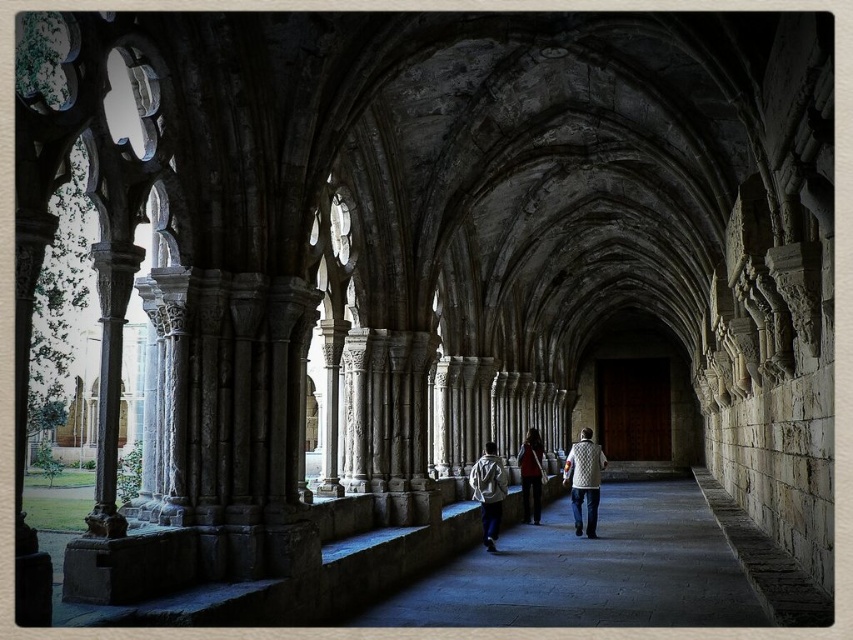
How far apart are white fabric jacket at center and matte red sweater at center?

white fabric jacket at center is 15.92 meters away from matte red sweater at center.

Is point (491, 468) closer to camera compared to point (535, 444)?

That is True.

Is point (485, 445) in front of point (523, 506)?

Yes, it is.

The height and width of the screenshot is (640, 853). In order to click on white fabric jacket at center in this screenshot , I will do `click(488, 492)`.

Which of these two, dark stone path at center or white knitted vest at center, stands taller?

With more height is white knitted vest at center.

Is dark stone path at center to the left of white knitted vest at center from the viewer's perspective?

Yes, dark stone path at center is to the left of white knitted vest at center.

The height and width of the screenshot is (640, 853). Describe the element at coordinates (590, 570) in the screenshot. I see `dark stone path at center` at that location.

You are a GUI agent. You are given a task and a screenshot of the screen. Output one action in this format:
    pyautogui.click(x=<x>, y=<y>)
    Task: Click on the dark stone path at center
    This screenshot has width=853, height=640.
    Given the screenshot: What is the action you would take?
    pyautogui.click(x=590, y=570)

Between white knitted vest at center and white fabric jacket at center, which one appears on the right side from the viewer's perspective?

Positioned to the right is white knitted vest at center.

Does point (589, 532) come closer to viewer compared to point (489, 545)?

No, it is behind (489, 545).

Locate an element on the screen. This screenshot has width=853, height=640. white knitted vest at center is located at coordinates (584, 481).